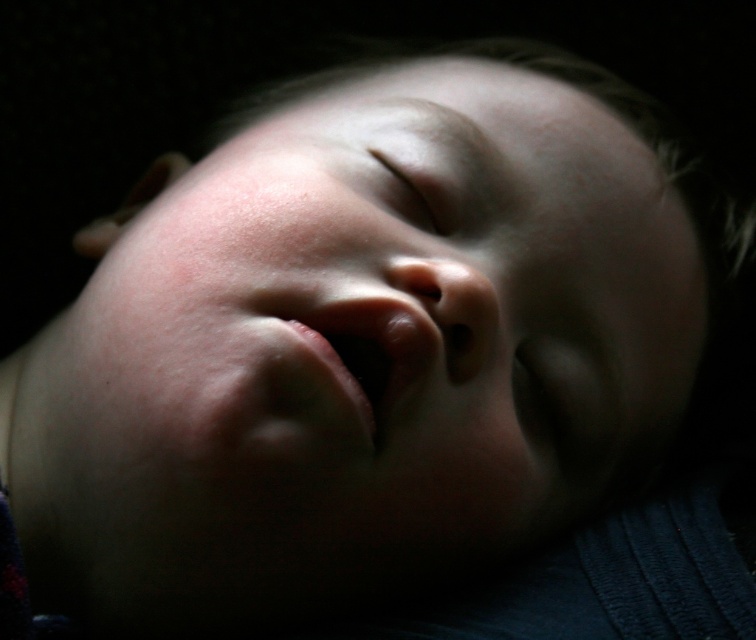
Question: Which point is closer to the camera?

Choices:
 (A) pink smooth lips at center
 (B) smooth skin face at center
 (C) smooth skin at center

Answer: (B)

Question: Can you confirm if smooth skin face at center is bigger than pink smooth lips at center?

Choices:
 (A) yes
 (B) no

Answer: (A)

Question: Does smooth skin face at center have a lesser width compared to smooth skin at center?

Choices:
 (A) no
 (B) yes

Answer: (A)

Question: Which of the following is the farthest from the observer?

Choices:
 (A) pink smooth lips at center
 (B) smooth skin at center

Answer: (B)

Question: Which object is the closest to the pink smooth lips at center?

Choices:
 (A) smooth skin face at center
 (B) smooth skin at center

Answer: (B)

Question: Does smooth skin face at center have a larger size compared to smooth skin at center?

Choices:
 (A) no
 (B) yes

Answer: (B)